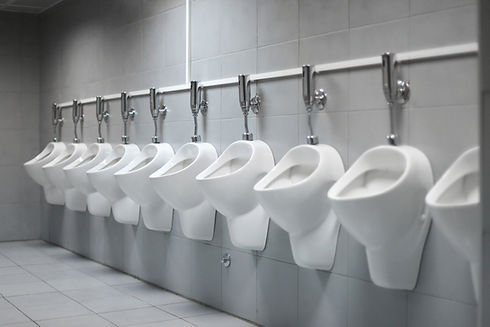
Locate an element on the screen. urinals is located at coordinates (443, 197), (367, 196), (294, 180), (237, 174), (185, 172), (131, 173), (102, 176), (76, 169), (54, 169), (33, 166).